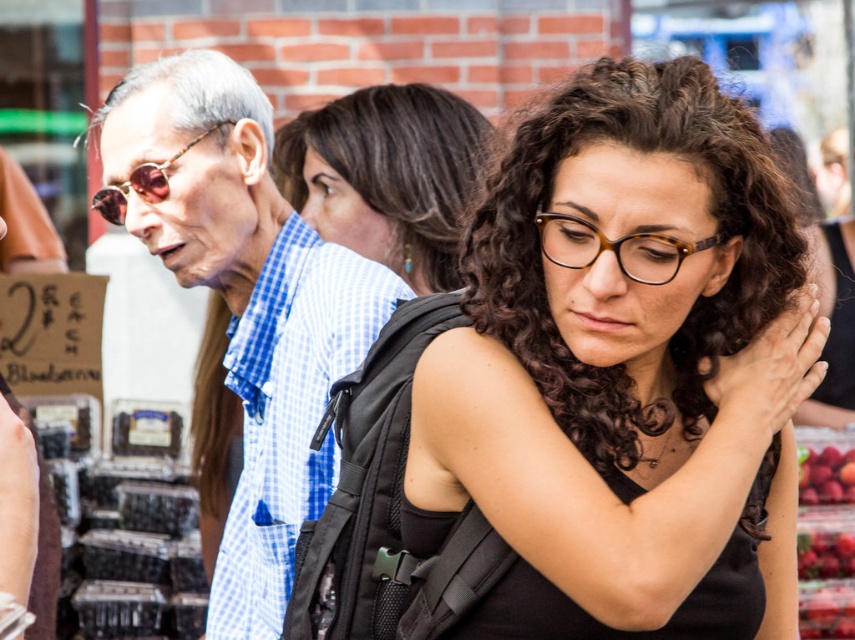
You are a photographer trying to capture a closeup of the ripe red berries at lower right without including the sunglassesmetallicglasses at left in the frame. Based on their positions, is this possible?

The ripe red berries at lower right is positioned under sunglassesmetallicglasses at left, so it is possible to capture a closeup of the ripe red berries at lower right without including the sunglassesmetallicglasses at left by adjusting the camera angle downward.